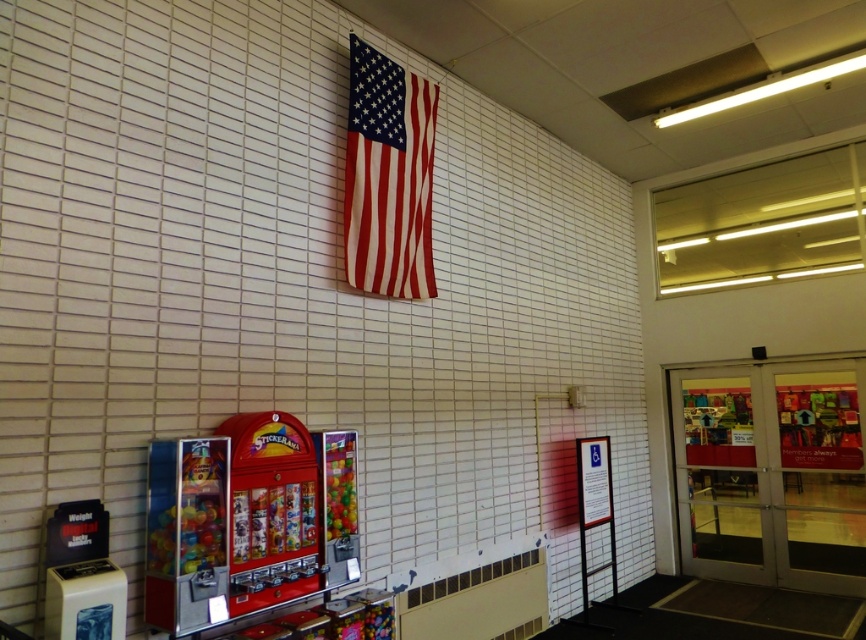
You are a customer standing in the convenience store and want to reach the shiny red vending machine at center from the matte fabric flag at upper center. Can you walk straight towards it without needing to move around any obstacles?

The matte fabric flag at upper center is 4.77 feet away from the shiny red vending machine at center. Since the flag is hanging on the wall and the vending machine is positioned in front of it, you can walk straight towards the shiny red vending machine at center without needing to move around any obstacles.

You are a customer standing in the store and want to check the price of an item on the shiny red vending machine at center. However, there is a matte fabric flag at upper center in the way. Can you easily see the vending machine through the flag?

The matte fabric flag at upper center is further to the viewer than the shiny red vending machine at center, so the flag is closer to you and blocking your view of the vending machine. You cannot easily see the vending machine through the flag.